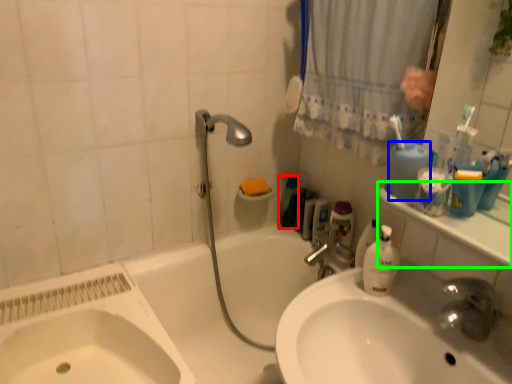
Question: Based on their relative distances, which object is farther from cleaning product (highlighted by a red box)? Choose from mouthwash (highlighted by a blue box) and counter top (highlighted by a green box).

Choices:
 (A) mouthwash
 (B) counter top

Answer: (B)